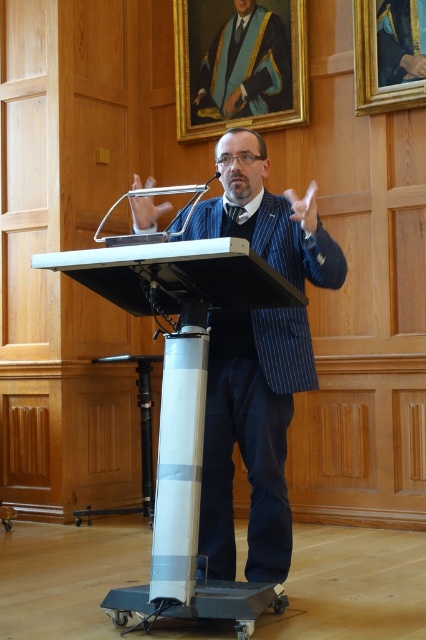
Question: Does blue pinstripe suit at center have a lesser width compared to white plastic podium at center?

Choices:
 (A) yes
 (B) no

Answer: (A)

Question: Which point is closer to the camera taking this photo?

Choices:
 (A) coord(287,108)
 (B) coord(279,474)
 (C) coord(167,520)

Answer: (C)

Question: Which point is farther to the camera?

Choices:
 (A) (253, 394)
 (B) (180, 545)
 (C) (230, 108)

Answer: (C)

Question: Is white plastic podium at center wider than matte gold and blue academic gown at upper center?

Choices:
 (A) yes
 (B) no

Answer: (A)

Question: Which of the following is the closest to the observer?

Choices:
 (A) (259, 61)
 (B) (212, 541)

Answer: (B)

Question: In this image, where is blue pinstripe suit at center located relative to matte gold and blue academic gown at upper center?

Choices:
 (A) left
 (B) right

Answer: (A)